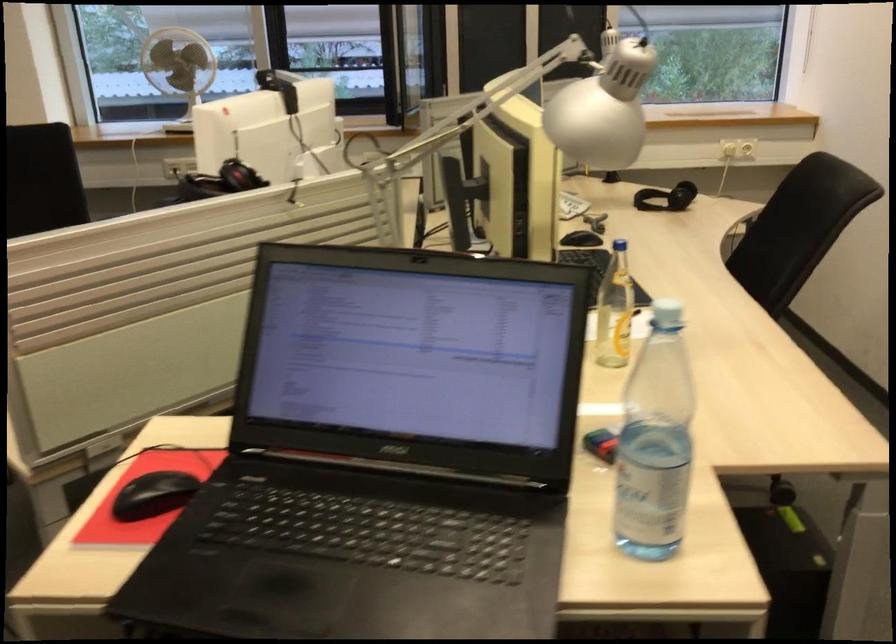
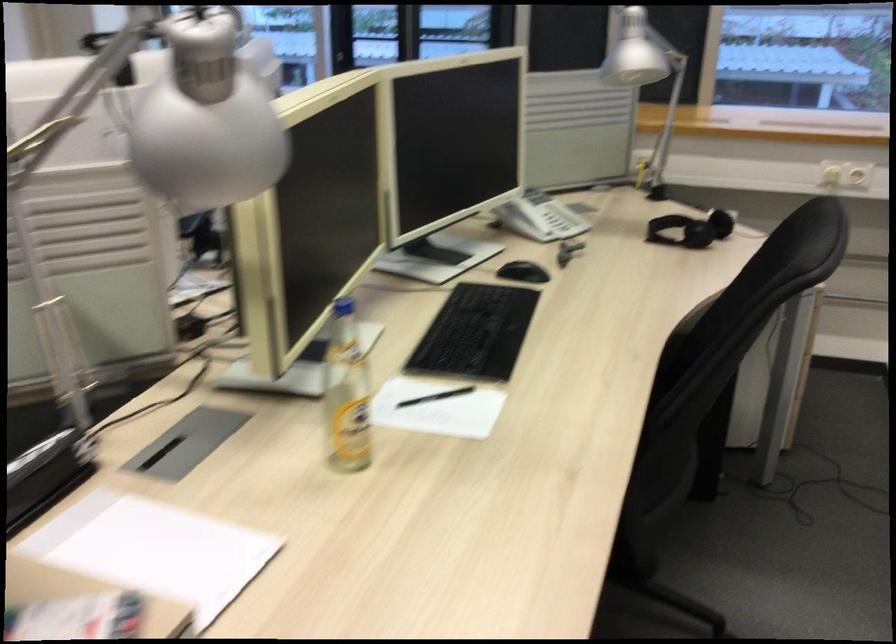
Question: The images are taken continuously from a first-person perspective. In which direction is your viewpoint rotating?

Choices:
 (A) Left
 (B) Right
 (C) Up
 (D) Down

Answer: (A)